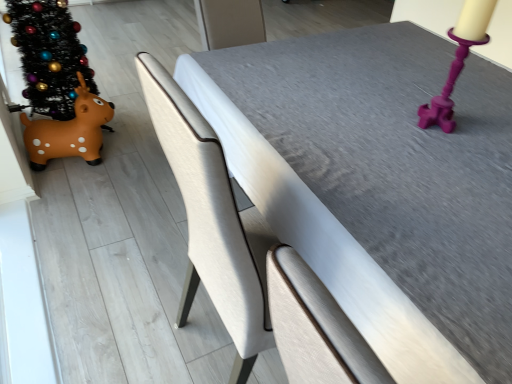
The width and height of the screenshot is (512, 384). In order to click on vacant area that is in front of brown rubber toy at left in this screenshot , I will do `click(68, 198)`.